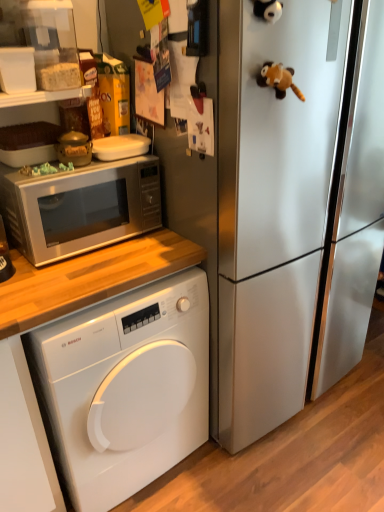
Question: Is satin silver refrigerator at center in front of brown plush toy at upper right?

Choices:
 (A) yes
 (B) no

Answer: (A)

Question: Is satin silver refrigerator at center next to brown plush toy at upper right?

Choices:
 (A) no
 (B) yes

Answer: (A)

Question: Is satin silver refrigerator at center not close to brown plush toy at upper right?

Choices:
 (A) yes
 (B) no

Answer: (B)

Question: Does satin silver refrigerator at center have a lesser height compared to brown plush toy at upper right?

Choices:
 (A) yes
 (B) no

Answer: (B)

Question: From the image's perspective, would you say satin silver refrigerator at center is shown under brown plush toy at upper right?

Choices:
 (A) yes
 (B) no

Answer: (A)

Question: From a real-world perspective, is brown plush toy at upper right above or below satin silver refrigerator at center?

Choices:
 (A) below
 (B) above

Answer: (B)

Question: Is point (276, 86) closer or farther from the camera than point (340, 351)?

Choices:
 (A) farther
 (B) closer

Answer: (B)

Question: In the image, is brown plush toy at upper right positioned in front of or behind satin silver refrigerator at center?

Choices:
 (A) behind
 (B) front

Answer: (A)

Question: Which is correct: brown plush toy at upper right is inside satin silver refrigerator at center, or outside of it?

Choices:
 (A) outside
 (B) inside

Answer: (B)

Question: Is satin silver refrigerator at center to the left or to the right of white glossy washing machine at lower left in the image?

Choices:
 (A) right
 (B) left

Answer: (A)

Question: Considering their positions, is satin silver refrigerator at center located in front of or behind white glossy washing machine at lower left?

Choices:
 (A) behind
 (B) front

Answer: (B)

Question: In terms of height, does satin silver refrigerator at center look taller or shorter compared to white glossy washing machine at lower left?

Choices:
 (A) tall
 (B) short

Answer: (A)

Question: Would you say satin silver refrigerator at center is inside or outside white glossy washing machine at lower left?

Choices:
 (A) inside
 (B) outside

Answer: (B)

Question: In terms of height, does satin silver microwave at upper left look taller or shorter compared to white glossy washing machine at lower left?

Choices:
 (A) tall
 (B) short

Answer: (B)

Question: From the image's perspective, is satin silver microwave at upper left positioned above or below white glossy washing machine at lower left?

Choices:
 (A) below
 (B) above

Answer: (B)